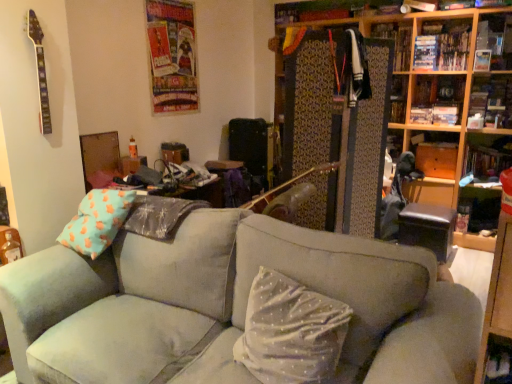
Question: From the image's perspective, would you say wooden bookshelf at right, marked as the first shelf in a bottom-to-top arrangement, is positioned over wooden bookshelf at upper right, the third shelf positioned from the bottom?

Choices:
 (A) yes
 (B) no

Answer: (B)

Question: From a real-world perspective, is wooden bookshelf at right, the fourth shelf in the top-to-bottom sequence, under wooden bookshelf at upper right, which appears as the second shelf when viewed from the top?

Choices:
 (A) yes
 (B) no

Answer: (A)

Question: Considering the relative sizes of wooden bookshelf at right, the fourth shelf in the top-to-bottom sequence, and wooden bookshelf at upper right, the third shelf positioned from the bottom, in the image provided, is wooden bookshelf at right, the fourth shelf in the top-to-bottom sequence, wider than wooden bookshelf at upper right, the third shelf positioned from the bottom,?

Choices:
 (A) no
 (B) yes

Answer: (B)

Question: Is wooden bookshelf at right, marked as the first shelf in a bottom-to-top arrangement, at the right side of wooden bookshelf at upper right, the third shelf positioned from the bottom?

Choices:
 (A) no
 (B) yes

Answer: (B)

Question: Considering the relative sizes of wooden bookshelf at right, marked as the first shelf in a bottom-to-top arrangement, and wooden bookshelf at upper right, which appears as the second shelf when viewed from the top, in the image provided, is wooden bookshelf at right, marked as the first shelf in a bottom-to-top arrangement, bigger than wooden bookshelf at upper right, which appears as the second shelf when viewed from the top,?

Choices:
 (A) yes
 (B) no

Answer: (A)

Question: Is wooden bookshelf at right, marked as the first shelf in a bottom-to-top arrangement, facing away from wooden bookshelf at upper right, which appears as the second shelf when viewed from the top?

Choices:
 (A) yes
 (B) no

Answer: (B)

Question: Is wooden bookshelf at upper right further to the viewer compared to white dotted fabric pillow at center?

Choices:
 (A) yes
 (B) no

Answer: (A)

Question: Is wooden bookshelf at upper right oriented away from white dotted fabric pillow at center?

Choices:
 (A) no
 (B) yes

Answer: (A)

Question: From a real-world perspective, is wooden bookshelf at upper right below white dotted fabric pillow at center?

Choices:
 (A) no
 (B) yes

Answer: (A)

Question: From a real-world perspective, is wooden bookshelf at upper right over white dotted fabric pillow at center?

Choices:
 (A) yes
 (B) no

Answer: (A)

Question: Does wooden bookshelf at upper right have a greater height compared to white dotted fabric pillow at center?

Choices:
 (A) yes
 (B) no

Answer: (A)

Question: Does wooden bookshelf at upper right come in front of white dotted fabric pillow at center?

Choices:
 (A) no
 (B) yes

Answer: (A)

Question: Is wooden bookshelf at right, marked as the first shelf in a bottom-to-top arrangement, shorter than wooden bookshelf at upper right?

Choices:
 (A) no
 (B) yes

Answer: (B)